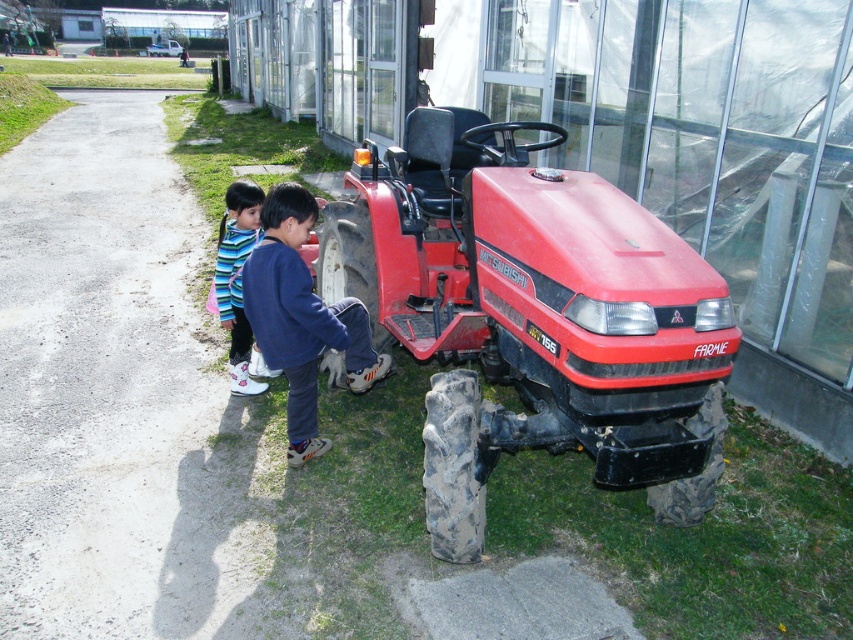
Who is taller, red matte tractor at center or blue fleece jacket at center?

With more height is red matte tractor at center.

Does point (457, 200) come in front of point (251, 292)?

No.

Image resolution: width=853 pixels, height=640 pixels. Find the location of `red matte tractor at center`. red matte tractor at center is located at coordinates (532, 316).

Looking at this image, is blue fleece jacket at center positioned at the back of striped fabric shoes at lower left?

No, it is in front of striped fabric shoes at lower left.

Who is more distant from viewer, (x=263, y=342) or (x=239, y=324)?

Positioned behind is point (x=239, y=324).

I want to click on blue fleece jacket at center, so click(x=302, y=317).

Does red matte tractor at center lie behind striped fabric shoes at lower left?

No, red matte tractor at center is in front of striped fabric shoes at lower left.

Does point (462, 262) lie behind point (245, 333)?

No, it is not.

Find the location of a particular element. This screenshot has height=640, width=853. red matte tractor at center is located at coordinates (532, 316).